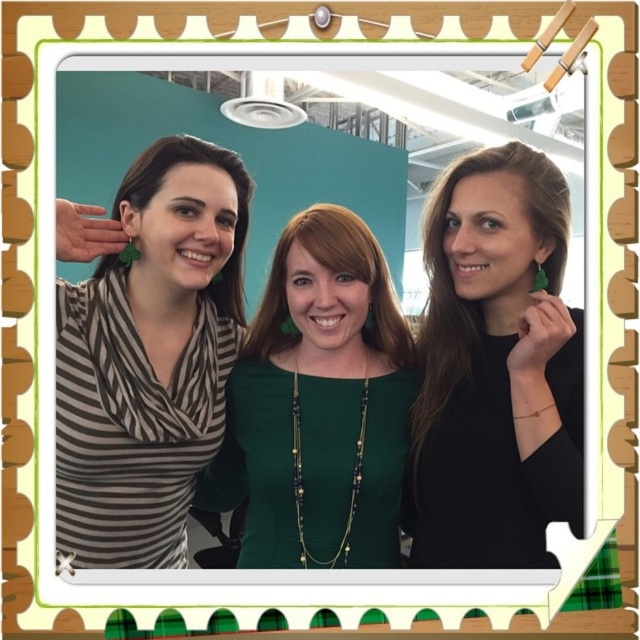
Looking at this image, which of these two, striped fabric scarf at left or smooth brown hair at center, stands shorter?

smooth brown hair at center

Does striped fabric scarf at left appear on the left side of smooth brown hair at center?

Correct, you'll find striped fabric scarf at left to the left of smooth brown hair at center.

Measure the distance between striped fabric scarf at left and camera.

striped fabric scarf at left and camera are 3.34 feet apart from each other.

This screenshot has width=640, height=640. I want to click on striped fabric scarf at left, so click(147, 353).

Image resolution: width=640 pixels, height=640 pixels. Find the location of `green matte earrings at center`. green matte earrings at center is located at coordinates (496, 369).

Between green matte earrings at center and brownhair at left, which one is positioned higher?

brownhair at left

The image size is (640, 640). In order to click on green matte earrings at center in this screenshot , I will do pyautogui.click(x=496, y=369).

Image resolution: width=640 pixels, height=640 pixels. In order to click on green matte earrings at center in this screenshot , I will do `click(496, 369)`.

Between green matte dress at center and brownhair at left, which one has less height?

With less height is brownhair at left.

Between green matte dress at center and brownhair at left, which one is positioned lower?

green matte dress at center is below.

What do you see at coordinates (317, 404) in the screenshot? I see `green matte dress at center` at bounding box center [317, 404].

You are a GUI agent. You are given a task and a screenshot of the screen. Output one action in this format:
    pyautogui.click(x=<x>, y=<y>)
    Task: Click on the green matte dress at center
    The width and height of the screenshot is (640, 640).
    Given the screenshot: What is the action you would take?
    pyautogui.click(x=317, y=404)